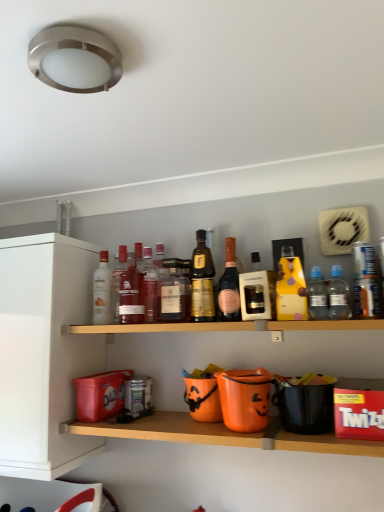
Identify the location of matte glass bottle at center, the seventh bottle positioned from the right. (131, 294).

What is the approximate width of gold metallic bottle at center, which ranks as the 6th bottle in left-to-right order?

It is 2.87 inches.

At what (x,y) coordinates should I click in order to perform the action: click on matte glass bottle at center, which is the sixth bottle in right-to-left order. Please return your answer as a coordinate pair (x, y). Looking at the image, I should click on (149, 285).

In order to face wooden shelf at center, the 1th shelf from the top, should I rotate leftwards or rightwards?

To align with it, rotate right about 3.763°.

Where is `matte glass bottle at center, the seventh bottle positioned from the right`? This screenshot has width=384, height=512. matte glass bottle at center, the seventh bottle positioned from the right is located at coordinates (131, 294).

Can white glass bottle at upper left, which is the ninth bottle in right-to-left order, be found inside matte glass bottle at center, acting as the second bottle starting from the left?

Actually, white glass bottle at upper left, which is the ninth bottle in right-to-left order, is outside matte glass bottle at center, acting as the second bottle starting from the left.

From a real-world perspective, which is physically below, matte glass bottle at center, acting as the second bottle starting from the left, or white glass bottle at upper left, which is the ninth bottle in right-to-left order?

From a 3D spatial view, white glass bottle at upper left, which is the ninth bottle in right-to-left order, is below.

Between matte glass bottle at center, acting as the second bottle starting from the left, and white glass bottle at upper left, which is the ninth bottle in right-to-left order, which one appears on the left side from the viewer's perspective?

white glass bottle at upper left, which is the ninth bottle in right-to-left order, is more to the left.

Considering the relative sizes of matte glass bottle at center, marked as the eighth bottle in a right-to-left arrangement, and white glass bottle at upper left, placed as the 1th bottle when sorted from left to right, in the image provided, is matte glass bottle at center, marked as the eighth bottle in a right-to-left arrangement, bigger than white glass bottle at upper left, placed as the 1th bottle when sorted from left to right,?

Indeed, matte glass bottle at center, marked as the eighth bottle in a right-to-left arrangement, has a larger size compared to white glass bottle at upper left, placed as the 1th bottle when sorted from left to right.

In the scene shown: Considering the relative sizes of white glass bottle at upper left, which is the ninth bottle in right-to-left order, and gold metallic bottle at center, which ranks as the 6th bottle in left-to-right order, in the image provided, is white glass bottle at upper left, which is the ninth bottle in right-to-left order, taller than gold metallic bottle at center, which ranks as the 6th bottle in left-to-right order,?

In fact, white glass bottle at upper left, which is the ninth bottle in right-to-left order, may be shorter than gold metallic bottle at center, which ranks as the 6th bottle in left-to-right order.

Is white glass bottle at upper left, which is the ninth bottle in right-to-left order, touching gold metallic bottle at center, which is counted as the 4th bottle, starting from the right?

white glass bottle at upper left, which is the ninth bottle in right-to-left order, and gold metallic bottle at center, which is counted as the 4th bottle, starting from the right, are not in contact.

From the image's perspective, between white glass bottle at upper left, placed as the 1th bottle when sorted from left to right, and gold metallic bottle at center, which ranks as the 6th bottle in left-to-right order, which one is located above?

From the image's view, gold metallic bottle at center, which ranks as the 6th bottle in left-to-right order, is above.

Can you confirm if white glass bottle at upper left, which is the ninth bottle in right-to-left order, is positioned to the left of gold metallic bottle at center, which is counted as the 4th bottle, starting from the right?

Correct, you'll find white glass bottle at upper left, which is the ninth bottle in right-to-left order, to the left of gold metallic bottle at center, which is counted as the 4th bottle, starting from the right.

Is wooden shelf at center, the 1th shelf from the top, far away from clear plastic bottle at right, the 9th bottle positioned from the left?

No, wooden shelf at center, the 1th shelf from the top, is not far away from clear plastic bottle at right, the 9th bottle positioned from the left.

Based on the photo, from the image's perspective, is wooden shelf at center, the 1th shelf from the top, below clear plastic bottle at right, marked as the first bottle in a right-to-left arrangement?

Yes, from the image's perspective, wooden shelf at center, the 1th shelf from the top, is below clear plastic bottle at right, marked as the first bottle in a right-to-left arrangement.

Which is behind, point (201, 323) or point (331, 301)?

Point (201, 323)

Does clear plastic bottle at right, marked as the first bottle in a right-to-left arrangement, have a lesser height compared to matte glass bottle at center, acting as the second bottle starting from the left?

Yes, clear plastic bottle at right, marked as the first bottle in a right-to-left arrangement, is shorter than matte glass bottle at center, acting as the second bottle starting from the left.

From a real-world perspective, which is physically above, clear plastic bottle at right, the 9th bottle positioned from the left, or matte glass bottle at center, marked as the eighth bottle in a right-to-left arrangement?

matte glass bottle at center, marked as the eighth bottle in a right-to-left arrangement, is physically above.

Is clear plastic bottle at right, the 9th bottle positioned from the left, inside the boundaries of matte glass bottle at center, acting as the second bottle starting from the left, or outside?

clear plastic bottle at right, the 9th bottle positioned from the left, is spatially situated outside matte glass bottle at center, acting as the second bottle starting from the left.

Which is correct: clear plastic bottle at right, the 9th bottle positioned from the left, is inside pink glass bottle at center, which ranks as the seventh bottle in left-to-right order, or outside of it?

clear plastic bottle at right, the 9th bottle positioned from the left, cannot be found inside pink glass bottle at center, which ranks as the seventh bottle in left-to-right order.

Is pink glass bottle at center, which ranks as the seventh bottle in left-to-right order, at the back of clear plastic bottle at right, marked as the first bottle in a right-to-left arrangement?

No, clear plastic bottle at right, marked as the first bottle in a right-to-left arrangement, is not facing away from pink glass bottle at center, which ranks as the seventh bottle in left-to-right order.

From the image's perspective, between clear plastic bottle at right, marked as the first bottle in a right-to-left arrangement, and pink glass bottle at center, the third bottle positioned from the right, which one is located above?

pink glass bottle at center, the third bottle positioned from the right, from the image's perspective.

Considering the relative sizes of gold metallic bottle at center, which is counted as the 4th bottle, starting from the right, and matte glass bottle at center, marked as the 5th bottle in a right-to-left arrangement, in the image provided, is gold metallic bottle at center, which is counted as the 4th bottle, starting from the right, thinner than matte glass bottle at center, marked as the 5th bottle in a right-to-left arrangement,?

Indeed, gold metallic bottle at center, which is counted as the 4th bottle, starting from the right, has a lesser width compared to matte glass bottle at center, marked as the 5th bottle in a right-to-left arrangement.

Is gold metallic bottle at center, which ranks as the 6th bottle in left-to-right order, positioned beyond the bounds of matte glass bottle at center, marked as the 5th bottle in a right-to-left arrangement?

Yes.

Which point is more distant from viewer, (198, 267) or (169, 290)?

The point (169, 290) is more distant.

From the image's perspective, is gold metallic bottle at center, which is counted as the 4th bottle, starting from the right, above or below matte glass bottle at center, marked as the 5th bottle in a right-to-left arrangement?

Based on their image positions, gold metallic bottle at center, which is counted as the 4th bottle, starting from the right, is located above matte glass bottle at center, marked as the 5th bottle in a right-to-left arrangement.

Based on the photo, is matte glass bottle at center, which is counted as the 3th bottle, starting from the left, to the right of pink glass bottle at center, the third bottle positioned from the right, from the viewer's perspective?

Incorrect, matte glass bottle at center, which is counted as the 3th bottle, starting from the left, is not on the right side of pink glass bottle at center, the third bottle positioned from the right.

Can you tell me how much matte glass bottle at center, the seventh bottle positioned from the right, and pink glass bottle at center, the third bottle positioned from the right, differ in facing direction?

The angular difference between matte glass bottle at center, the seventh bottle positioned from the right, and pink glass bottle at center, the third bottle positioned from the right, is 0.00241 degrees.

Find the location of a particular element. the 1st bottle behind the pink glass bottle at center, which ranks as the seventh bottle in left-to-right order, counting from the anchor's position is located at coordinates (131, 294).

Is matte glass bottle at center, which is counted as the 3th bottle, starting from the left, directly adjacent to pink glass bottle at center, which ranks as the seventh bottle in left-to-right order?

No, matte glass bottle at center, which is counted as the 3th bottle, starting from the left, is not with pink glass bottle at center, which ranks as the seventh bottle in left-to-right order.

Where is `bottle that is the 3rd one when counting downward from the matte glass bottle at center, acting as the second bottle starting from the left (from the image's perspective)`? This screenshot has width=384, height=512. bottle that is the 3rd one when counting downward from the matte glass bottle at center, acting as the second bottle starting from the left (from the image's perspective) is located at coordinates pyautogui.click(x=102, y=291).

Where is `the 5th bottle counting from the right of the white glass bottle at upper left, placed as the 1th bottle when sorted from left to right`? This screenshot has height=512, width=384. the 5th bottle counting from the right of the white glass bottle at upper left, placed as the 1th bottle when sorted from left to right is located at coordinates (202, 281).

Based on their spatial positions, is matte glass bottle at center, which is the sixth bottle in right-to-left order, or matte glass bottle at center, the seventh bottle positioned from the right, closer to white glass bottle at upper left, which is the ninth bottle in right-to-left order?

Based on the image, matte glass bottle at center, the seventh bottle positioned from the right, appears to be nearer to white glass bottle at upper left, which is the ninth bottle in right-to-left order.

Looking at the image, which one is located further to matte glass bottle at center, the seventh bottle positioned from the right, white glass bottle at upper left, placed as the 1th bottle when sorted from left to right, or matte glass bottle at center, arranged as the 5th bottle when viewed from the left?

matte glass bottle at center, arranged as the 5th bottle when viewed from the left, is further to matte glass bottle at center, the seventh bottle positioned from the right.

Estimate the real-world distances between objects in this image. Which object is closer to gold metallic bottle at center, which ranks as the 6th bottle in left-to-right order, matte glass bottle at center, marked as the 5th bottle in a right-to-left arrangement, or orange plastic buckets at lower center, the 1th shelf ordered from the bottom?

matte glass bottle at center, marked as the 5th bottle in a right-to-left arrangement, is positioned closer to the anchor gold metallic bottle at center, which ranks as the 6th bottle in left-to-right order.

When comparing their distances from wooden shelf at center, the 2th shelf when ordered from bottom to top, does pink glass bottle at center, the third bottle positioned from the right, or orange plastic buckets at lower center, the 1th shelf ordered from the bottom, seem closer?

pink glass bottle at center, the third bottle positioned from the right, lies closer to wooden shelf at center, the 2th shelf when ordered from bottom to top, than the other object.

Which object lies further to the anchor point matte glass bottle at center, marked as the eighth bottle in a right-to-left arrangement, clear plastic bottle at right, marked as the first bottle in a right-to-left arrangement, or gold metallic bottle at center, which is counted as the 4th bottle, starting from the right?

clear plastic bottle at right, marked as the first bottle in a right-to-left arrangement, is positioned further to the anchor matte glass bottle at center, marked as the eighth bottle in a right-to-left arrangement.

From the image, which object appears to be nearer to matte glass bottle at center, marked as the fourth bottle in a left-to-right arrangement, matte glass bottle at center, marked as the 5th bottle in a right-to-left arrangement, or wooden shelf at center, the 1th shelf from the top?

The object closer to matte glass bottle at center, marked as the fourth bottle in a left-to-right arrangement, is matte glass bottle at center, marked as the 5th bottle in a right-to-left arrangement.

Considering their positions, is clear plastic bottle at center right, which appears as the 8th bottle when viewed from the left, positioned further to pink glass bottle at center, which ranks as the seventh bottle in left-to-right order, than matte glass bottle at center, which is counted as the 3th bottle, starting from the left?

matte glass bottle at center, which is counted as the 3th bottle, starting from the left, lies further to pink glass bottle at center, which ranks as the seventh bottle in left-to-right order, than the other object.

When comparing their distances from matte glass bottle at center, marked as the 5th bottle in a right-to-left arrangement, does orange plastic buckets at lower center, acting as the second shelf starting from the top, or clear plastic bottle at center right, which appears as the 8th bottle when viewed from the left, seem closer?

Based on the image, orange plastic buckets at lower center, acting as the second shelf starting from the top, appears to be nearer to matte glass bottle at center, marked as the 5th bottle in a right-to-left arrangement.

In order to click on bottle between matte glass bottle at center, arranged as the 5th bottle when viewed from the left, and orange plastic buckets at lower center, the 1th shelf ordered from the bottom, vertically in this screenshot , I will do `click(102, 291)`.

You are a GUI agent. You are given a task and a screenshot of the screen. Output one action in this format:
    pyautogui.click(x=<x>, y=<y>)
    Task: Click on the shelf between clear plastic bottle at right, the 9th bottle positioned from the left, and orange plastic buckets at lower center, acting as the second shelf starting from the top, in the vertical direction
    The image size is (384, 512).
    Given the screenshot: What is the action you would take?
    pyautogui.click(x=226, y=326)

Locate an element on the screen. The image size is (384, 512). bottle situated between matte glass bottle at center, the seventh bottle positioned from the right, and matte glass bottle at center, marked as the 5th bottle in a right-to-left arrangement, from left to right is located at coordinates click(x=149, y=285).

Where is `bottle located between white matte cabinet at left and matte glass bottle at center, marked as the eighth bottle in a right-to-left arrangement, in the left-right direction`? The width and height of the screenshot is (384, 512). bottle located between white matte cabinet at left and matte glass bottle at center, marked as the eighth bottle in a right-to-left arrangement, in the left-right direction is located at coordinates (102, 291).